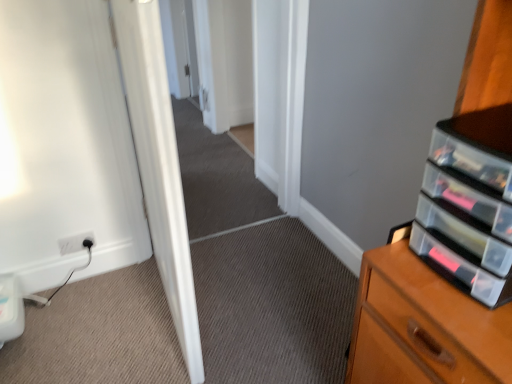
Find the location of a particular element. This screenshot has width=512, height=384. clear plastic drawers at right is located at coordinates (469, 204).

What do you see at coordinates (76, 243) in the screenshot? I see `white plastic electric outlet at lower left` at bounding box center [76, 243].

Find the location of a particular element. The height and width of the screenshot is (384, 512). clear plastic drawers at right is located at coordinates (469, 204).

From the image's perspective, is white glossy door at center above or below clear plastic drawers at right?

From the image's perspective, white glossy door at center appears above clear plastic drawers at right.

Between point (124, 69) and point (445, 250), which one is positioned in front?

The point (445, 250) is more forward.

From a real-world perspective, is white glossy door at center above or below clear plastic drawers at right?

From a real-world perspective, white glossy door at center is physically below clear plastic drawers at right.

Is clear plastic drawers at right located outside white glossy door at center?

Absolutely, clear plastic drawers at right is external to white glossy door at center.

Does point (501, 269) come behind point (150, 129)?

No.

How distant is clear plastic drawers at right from white glossy door at center?

clear plastic drawers at right is 28.95 inches away from white glossy door at center.

Based on the photo, from the image's perspective, does clear plastic drawers at right appear lower than white glossy door at center?

Yes.

From the image's perspective, is white plastic electric outlet at lower left below clear plastic drawers at right?

Correct, white plastic electric outlet at lower left appears lower than clear plastic drawers at right in the image.

Does point (91, 242) appear closer or farther from the camera than point (431, 211)?

Point (91, 242) is positioned farther from the camera compared to point (431, 211).

Consider the image. From a real-world perspective, is white plastic electric outlet at lower left above or below clear plastic drawers at right?

In terms of real-world spatial position, white plastic electric outlet at lower left is below clear plastic drawers at right.

Consider the image. Measure the distance from white glossy door at center to white plastic electric outlet at lower left.

A distance of 29.47 inches exists between white glossy door at center and white plastic electric outlet at lower left.

Can you confirm if white glossy door at center is positioned to the left of white plastic electric outlet at lower left?

No, white glossy door at center is not to the left of white plastic electric outlet at lower left.

Which point is more distant from viewer, (133, 30) or (70, 246)?

The point (70, 246) is behind.

Is white glossy door at center next to white plastic electric outlet at lower left?

They are not placed beside each other.

Is white plastic electric outlet at lower left in front of or behind white glossy door at center in the image?

white plastic electric outlet at lower left is positioned farther from the viewer than white glossy door at center.

From the image's perspective, relative to white glossy door at center, is white plastic electric outlet at lower left above or below?

white plastic electric outlet at lower left is below white glossy door at center.

From a real-world perspective, who is located higher, white plastic electric outlet at lower left or white glossy door at center?

white glossy door at center, from a real-world perspective.

From the picture: Is white plastic electric outlet at lower left to the left or to the right of white glossy door at center in the image?

Based on their positions, white plastic electric outlet at lower left is located to the left of white glossy door at center.

Does clear plastic drawers at right turn towards white plastic electric outlet at lower left?

No, clear plastic drawers at right is not facing towards white plastic electric outlet at lower left.

Consider the image. Can you tell me how much clear plastic drawers at right and white plastic electric outlet at lower left differ in facing direction?

The angle between the facing direction of clear plastic drawers at right and the facing direction of white plastic electric outlet at lower left is 90.2 degrees.

Which object is thinner, clear plastic drawers at right or white plastic electric outlet at lower left?

With smaller width is white plastic electric outlet at lower left.

From the image's perspective, between clear plastic drawers at right and white plastic electric outlet at lower left, who is located below?

white plastic electric outlet at lower left appears lower in the image.

The height and width of the screenshot is (384, 512). Identify the location of shelf above the white glossy door at center (from a real-world perspective). (469, 204).

Locate an element on the screen. Image resolution: width=512 pixels, height=384 pixels. shelf in front of the white glossy door at center is located at coordinates (469, 204).

Consider the image. When comparing their distances from white glossy door at center, does clear plastic drawers at right or white plastic electric outlet at lower left seem further?

Based on the image, white plastic electric outlet at lower left appears to be further to white glossy door at center.

When comparing their distances from white plastic electric outlet at lower left, does clear plastic drawers at right or white glossy door at center seem further?

The object further to white plastic electric outlet at lower left is clear plastic drawers at right.

Considering their positions, is white plastic electric outlet at lower left positioned closer to white glossy door at center than clear plastic drawers at right?

clear plastic drawers at right is positioned closer to the anchor white glossy door at center.

When comparing their distances from clear plastic drawers at right, does white plastic electric outlet at lower left or white glossy door at center seem further?

white plastic electric outlet at lower left.

When comparing their distances from clear plastic drawers at right, does white glossy door at center or white plastic electric outlet at lower left seem further?

white plastic electric outlet at lower left is positioned further to the anchor clear plastic drawers at right.

Considering their positions, is white glossy door at center positioned closer to white plastic electric outlet at lower left than clear plastic drawers at right?

Among the two, white glossy door at center is located nearer to white plastic electric outlet at lower left.

Identify the location of door situated between white plastic electric outlet at lower left and clear plastic drawers at right from left to right. The image size is (512, 384). (159, 164).